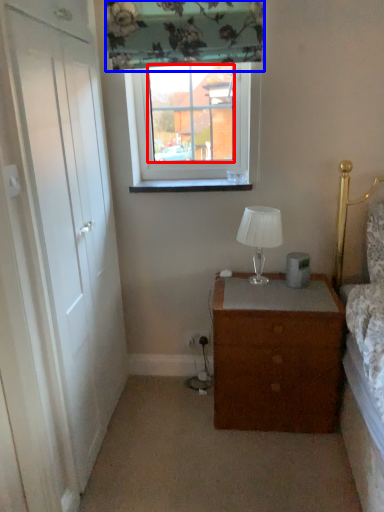
Question: Which object is closer to the camera taking this photo, window screen (highlighted by a red box) or curtain (highlighted by a blue box)?

Choices:
 (A) window screen
 (B) curtain

Answer: (B)